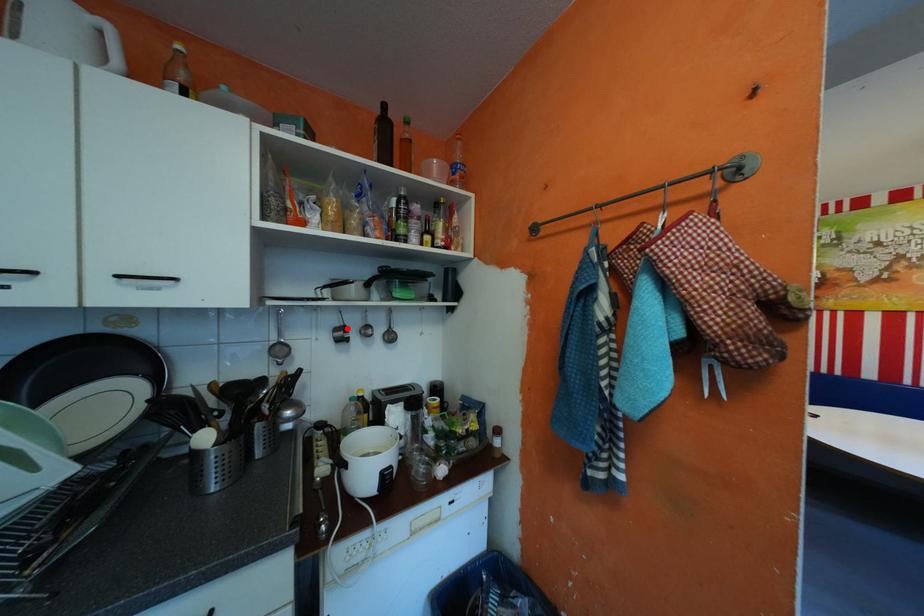
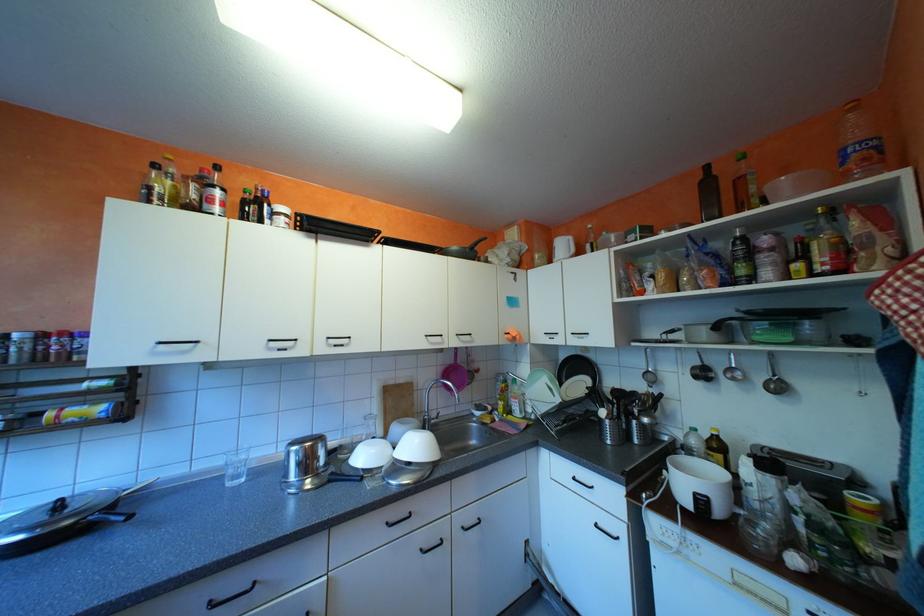
In the second image, find the point that corresponds to the highlighted location in the first image.

(706, 367)